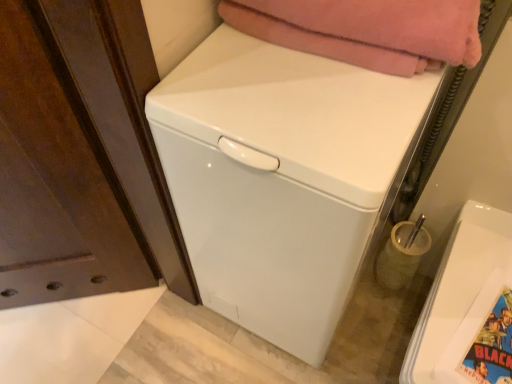
In order to click on vacant area situated to the left side of translucent glass toothbrush holder at lower right in this screenshot , I will do `click(362, 292)`.